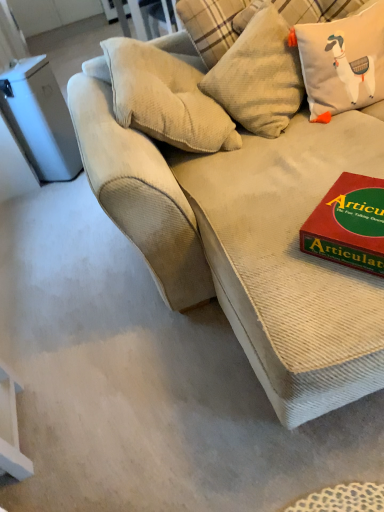
Question: Could red cardboard game at right be considered to be inside textured beige pillow at upper center, which is the first pillow from left to right?

Choices:
 (A) yes
 (B) no

Answer: (B)

Question: Is textured beige pillow at upper center, the 2th pillow when ordered from right to left, facing towards red cardboard game at right?

Choices:
 (A) yes
 (B) no

Answer: (B)

Question: Is textured beige pillow at upper center, which is the first pillow from left to right, taller than red cardboard game at right?

Choices:
 (A) yes
 (B) no

Answer: (A)

Question: Does textured beige pillow at upper center, which is the first pillow from left to right, have a larger size compared to red cardboard game at right?

Choices:
 (A) no
 (B) yes

Answer: (B)

Question: Considering the relative sizes of textured beige pillow at upper center, which is the first pillow from left to right, and red cardboard game at right in the image provided, is textured beige pillow at upper center, which is the first pillow from left to right, thinner than red cardboard game at right?

Choices:
 (A) no
 (B) yes

Answer: (B)

Question: In terms of height, does beige textured cushion at upper right, positioned as the first pillow in right-to-left order, look taller or shorter compared to red cardboard game at right?

Choices:
 (A) tall
 (B) short

Answer: (A)

Question: In terms of size, does beige textured cushion at upper right, positioned as the first pillow in right-to-left order, appear bigger or smaller than red cardboard game at right?

Choices:
 (A) small
 (B) big

Answer: (B)

Question: Is beige textured cushion at upper right, which is the 2th pillow from left to right, inside the boundaries of red cardboard game at right, or outside?

Choices:
 (A) outside
 (B) inside

Answer: (A)

Question: From a real-world perspective, relative to red cardboard game at right, is beige textured cushion at upper right, which is the 2th pillow from left to right, vertically above or below?

Choices:
 (A) above
 (B) below

Answer: (A)

Question: In terms of size, does beige corduroy couch at center appear bigger or smaller than red cardboard game at right?

Choices:
 (A) big
 (B) small

Answer: (A)

Question: Relative to red cardboard game at right, is beige corduroy couch at center in front or behind?

Choices:
 (A) behind
 (B) front

Answer: (B)

Question: Based on their positions, is beige corduroy couch at center located to the left or right of red cardboard game at right?

Choices:
 (A) left
 (B) right

Answer: (B)

Question: In terms of width, does beige corduroy couch at center look wider or thinner when compared to red cardboard game at right?

Choices:
 (A) thin
 (B) wide

Answer: (B)

Question: In terms of width, does beige corduroy couch at center look wider or thinner when compared to textured beige pillow at upper center, the 2th pillow when ordered from right to left?

Choices:
 (A) thin
 (B) wide

Answer: (B)

Question: From the image's perspective, is beige corduroy couch at center positioned above or below textured beige pillow at upper center, which is the first pillow from left to right?

Choices:
 (A) above
 (B) below

Answer: (B)